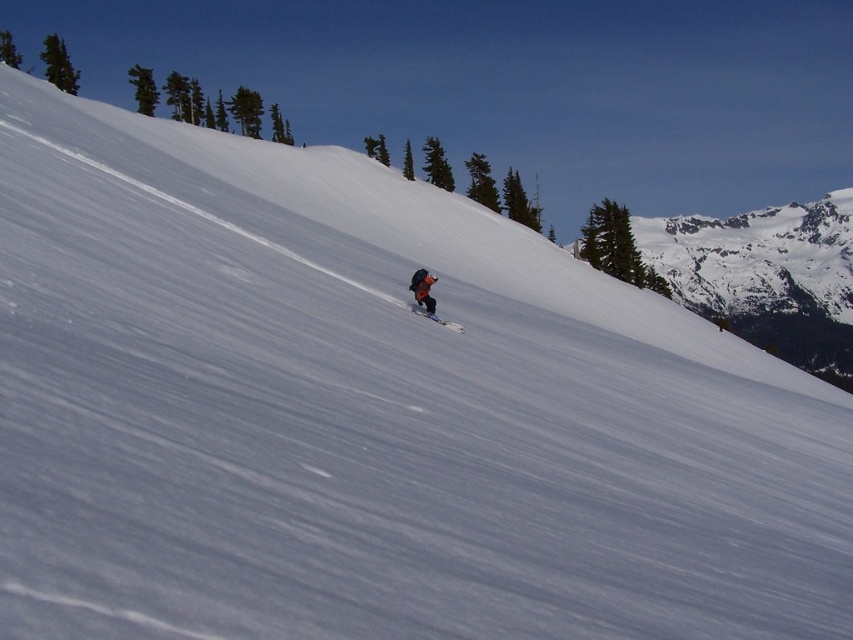
Who is positioned more to the right, matte black jacket at center or matte orange ski at center?

From the viewer's perspective, matte orange ski at center appears more on the right side.

Is point (426, 308) closer to viewer compared to point (427, 314)?

That is False.

Where is `matte black jacket at center`? The width and height of the screenshot is (853, 640). matte black jacket at center is located at coordinates (422, 289).